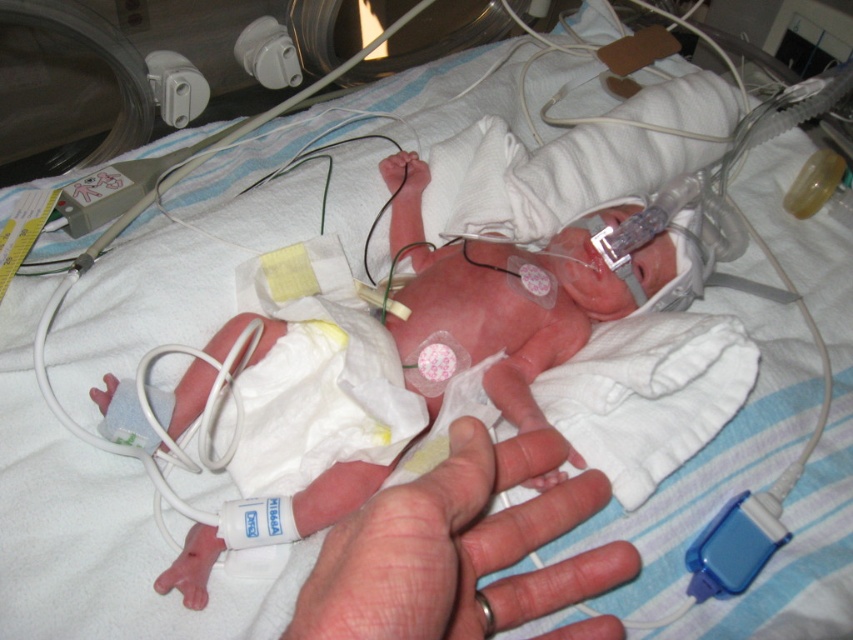
Question: Can you confirm if smooth skin hand at center is smaller than rubber teething ring at lower center?

Choices:
 (A) yes
 (B) no

Answer: (B)

Question: Is smooth skin hand at center bigger than rubber teething ring at lower center?

Choices:
 (A) yes
 (B) no

Answer: (A)

Question: Which of the following is the closest to the observer?

Choices:
 (A) rubber teething ring at lower center
 (B) smooth skin hand at center

Answer: (B)

Question: Does smooth skin hand at center appear on the right side of rubber teething ring at lower center?

Choices:
 (A) no
 (B) yes

Answer: (A)

Question: Which of the following is the closest to the observer?

Choices:
 (A) (482, 604)
 (B) (598, 579)

Answer: (A)